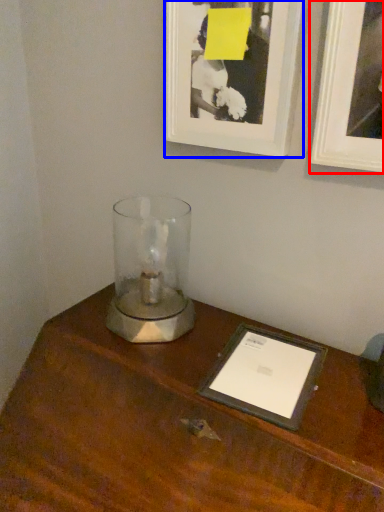
Question: Which point is further to the camera, picture frame (highlighted by a red box) or picture frame (highlighted by a blue box)?

Choices:
 (A) picture frame
 (B) picture frame

Answer: (B)